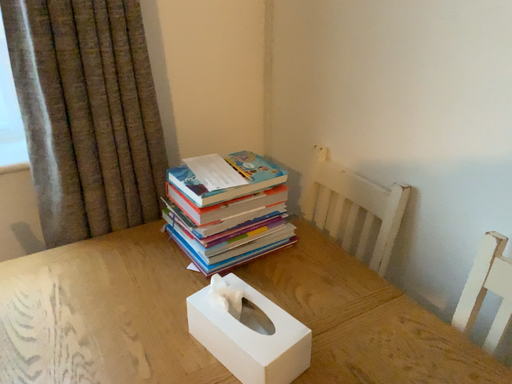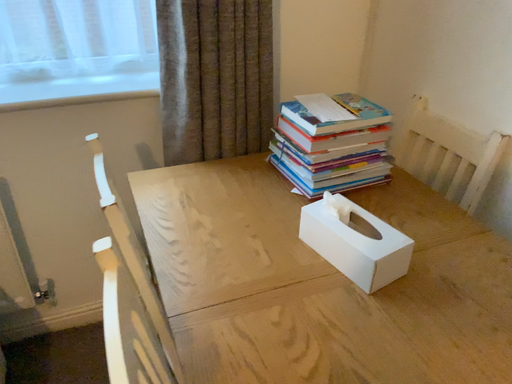
Question: Which way did the camera rotate in the video?

Choices:
 (A) rotated right
 (B) rotated left

Answer: (B)